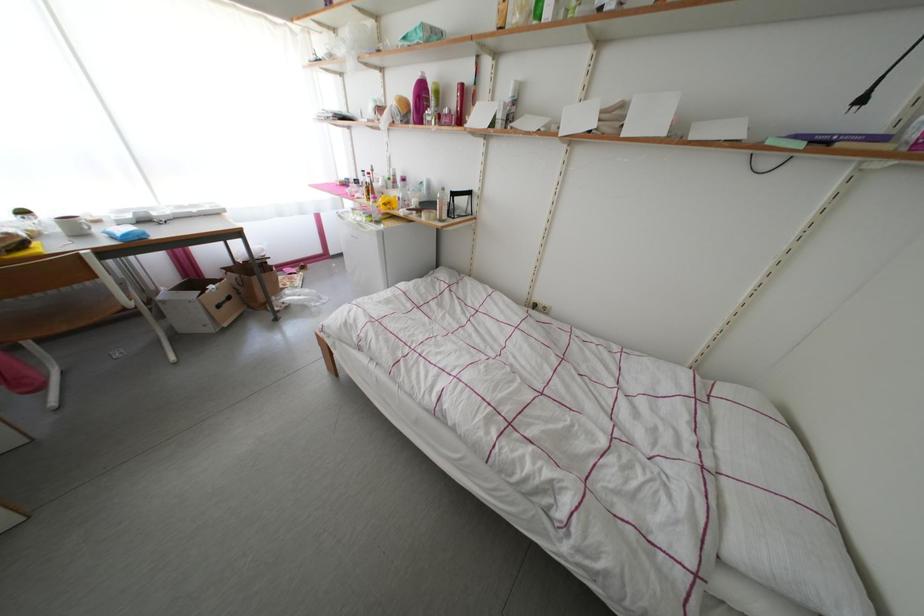
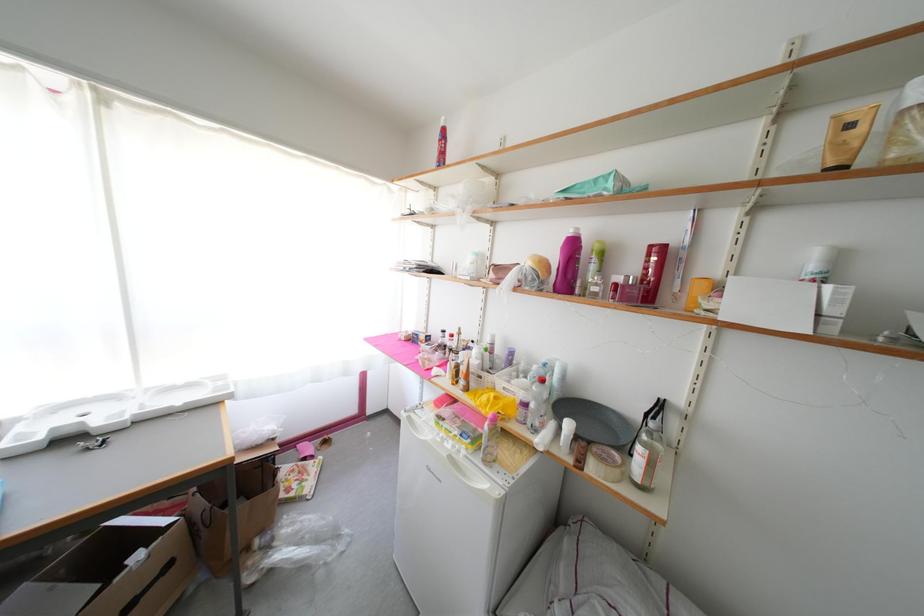
In a continuous first-person perspective shot, in which direction is the camera moving?

The movement direction of the cameraman is left, forward.